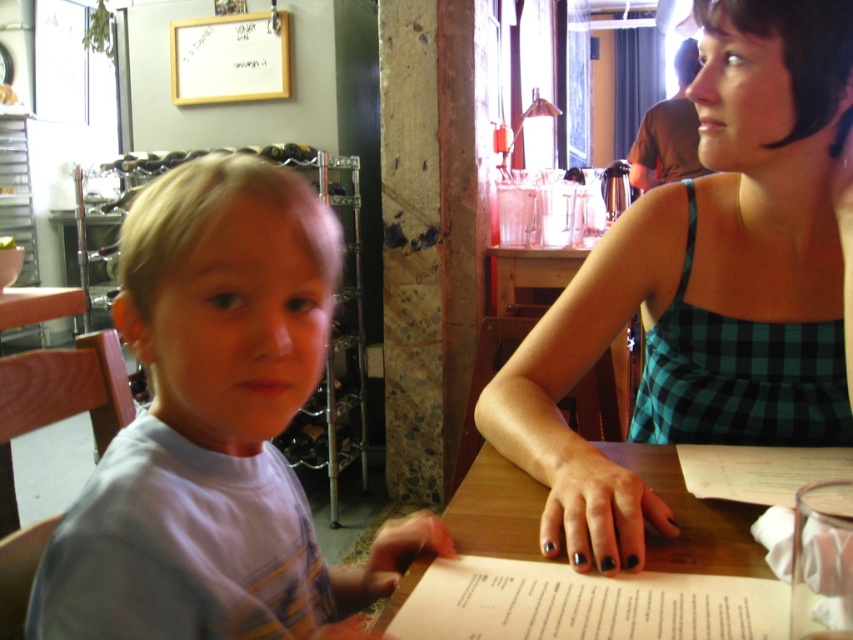
Does white paper menu at lower center have a greater height compared to wooden table at center?

No, white paper menu at lower center is not taller than wooden table at center.

Does white paper menu at lower center appear under wooden table at center?

Correct, white paper menu at lower center is located below wooden table at center.

Who is more distant from viewer, [556,624] or [520,493]?

The point [520,493] is more distant.

Locate an element on the screen. This screenshot has width=853, height=640. white paper menu at lower center is located at coordinates (585, 604).

What do you see at coordinates (215, 428) in the screenshot? I see `light blue t-shirt at left` at bounding box center [215, 428].

Measure the distance between point (260, 305) and camera.

Point (260, 305) and camera are 20.66 inches apart from each other.

This screenshot has width=853, height=640. In order to click on light blue t-shirt at left in this screenshot , I will do `click(215, 428)`.

Does green checkered dress at upper right have a greater height compared to wooden table at center?

Correct, green checkered dress at upper right is much taller as wooden table at center.

The width and height of the screenshot is (853, 640). I want to click on green checkered dress at upper right, so click(706, 285).